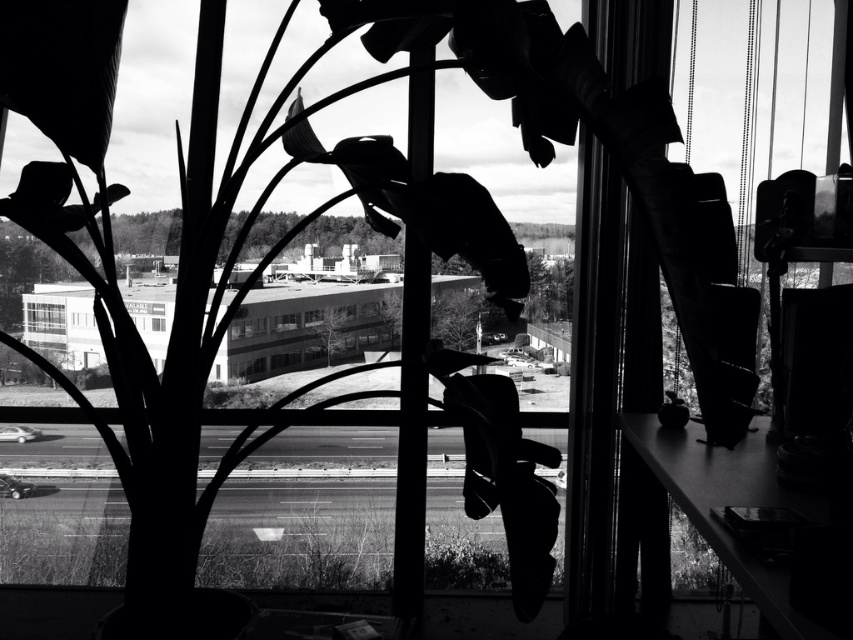
How much distance is there between clear glass window at center and transparent glass window at center?

clear glass window at center and transparent glass window at center are 21.18 inches apart.

Who is taller, clear glass window at center or transparent glass window at center?

clear glass window at center is taller.

Describe the element at coordinates (44, 317) in the screenshot. I see `clear glass window at center` at that location.

Where is `clear glass window at center`? Image resolution: width=853 pixels, height=640 pixels. clear glass window at center is located at coordinates (44, 317).